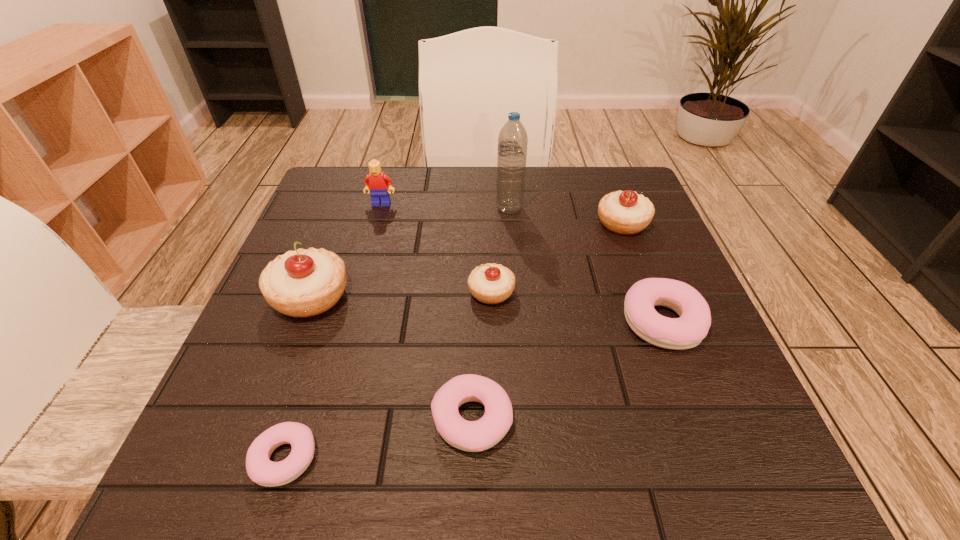
Find the location of a particular element. the farthest pink pastry is located at coordinates (688, 331).

The width and height of the screenshot is (960, 540). Identify the location of the seventh tallest object. (473, 436).

Identify the location of the second smallest pink pastry. Image resolution: width=960 pixels, height=540 pixels. (473, 436).

I want to click on the shortest object, so click(x=260, y=469).

Identify the location of the leftmost pink pastry. (260, 469).

Locate an element on the screen. The height and width of the screenshot is (540, 960). vacant point located 0.050m on the front of the water bottle is located at coordinates (511, 230).

Identify the location of free space located 0.120m on the face of the Lego. (372, 239).

This screenshot has height=540, width=960. Find the location of `vacant space situated 0.170m on the front of the leftmost beige pastry`. vacant space situated 0.170m on the front of the leftmost beige pastry is located at coordinates (266, 412).

Find the location of a particular element. This screenshot has height=540, width=960. blank space located on the front of the fifth shortest object is located at coordinates (666, 338).

Identify the location of vacant region located 0.090m on the back of the second beige pastry from right to left. The width and height of the screenshot is (960, 540). (491, 246).